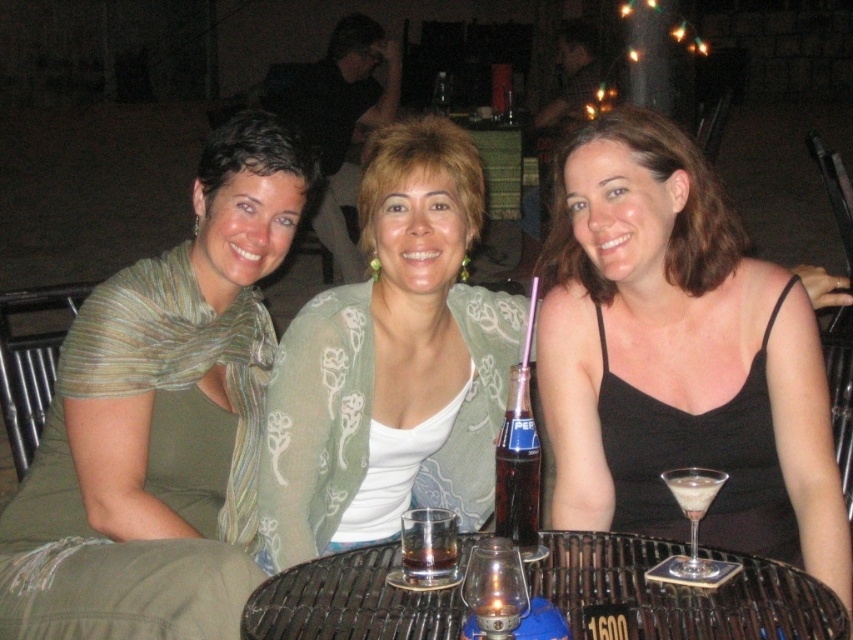
Does light green sheer cardigan at center lie behind white creamy liquid at center?

Yes, it is behind white creamy liquid at center.

Who is positioned more to the left, light green sheer cardigan at center or white creamy liquid at center?

From the viewer's perspective, light green sheer cardigan at center appears more on the left side.

Is point (440, 129) closer to camera compared to point (675, 496)?

That is False.

Image resolution: width=853 pixels, height=640 pixels. Identify the location of light green sheer cardigan at center. (392, 364).

Between point (288, 493) and point (430, 595), which one is positioned in front?

Point (430, 595) is in front.

Can you confirm if light green sheer cardigan at center is positioned below wooden textured table at center?

No, light green sheer cardigan at center is not below wooden textured table at center.

Is point (422, 464) farther from viewer compared to point (316, 614)?

Yes, point (422, 464) is farther from viewer.

You are a GUI agent. You are given a task and a screenshot of the screen. Output one action in this format:
    pyautogui.click(x=<x>, y=<y>)
    Task: Click on the light green sheer cardigan at center
    The height and width of the screenshot is (640, 853).
    Given the screenshot: What is the action you would take?
    pyautogui.click(x=392, y=364)

The width and height of the screenshot is (853, 640). What do you see at coordinates (428, 556) in the screenshot? I see `clear glass at table center` at bounding box center [428, 556].

In the scene shown: Which of these two, clear glass at table center or white creamy liquid at center, stands shorter?

Standing shorter between the two is white creamy liquid at center.

In order to click on clear glass at table center in this screenshot , I will do `click(428, 556)`.

The width and height of the screenshot is (853, 640). Find the location of `clear glass at table center`. clear glass at table center is located at coordinates (428, 556).